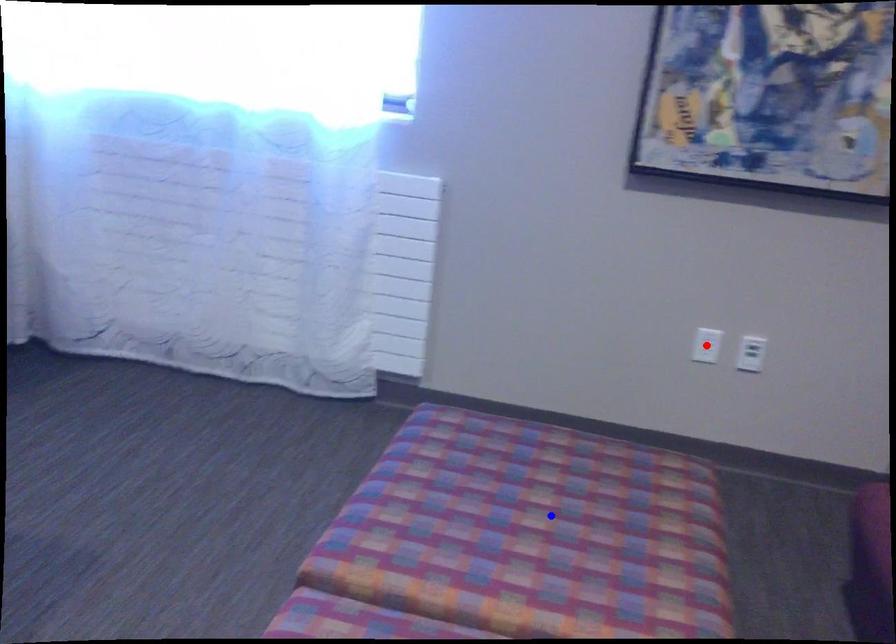
Question: Two points are marked on the image. Which point is closer to the camera?

Choices:
 (A) Blue point is closer.
 (B) Red point is closer.

Answer: (A)